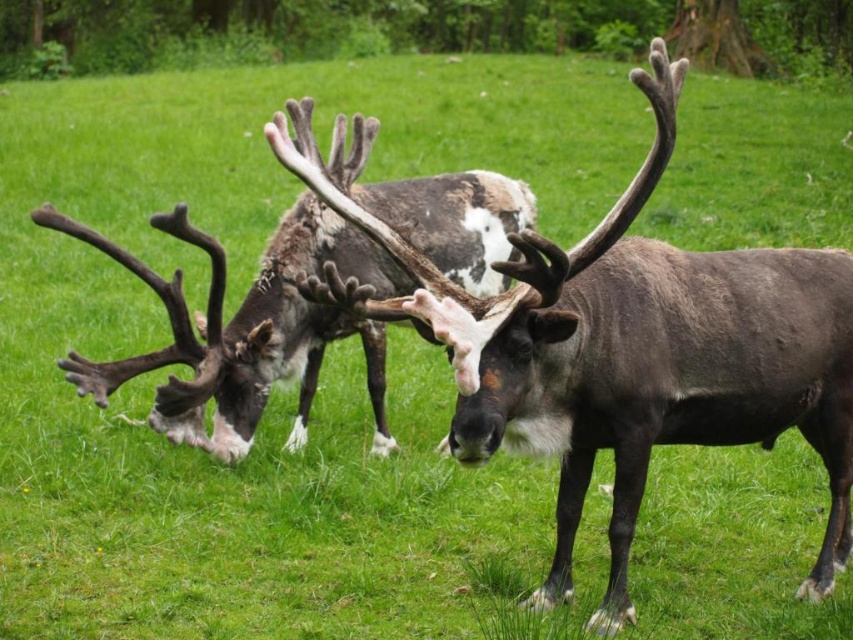
Question: Is dark brown fur antlers at center above speckled fur reindeer at center?

Choices:
 (A) no
 (B) yes

Answer: (A)

Question: Does dark brown fur antlers at center have a lesser width compared to speckled fur reindeer at center?

Choices:
 (A) no
 (B) yes

Answer: (B)

Question: Which of the following is the closest to the observer?

Choices:
 (A) dark brown fur antlers at center
 (B) speckled fur reindeer at center

Answer: (A)

Question: Which point appears closest to the camera in this image?

Choices:
 (A) (466, 285)
 (B) (699, 435)

Answer: (B)

Question: Does dark brown fur antlers at center appear on the left side of speckled fur reindeer at center?

Choices:
 (A) no
 (B) yes

Answer: (A)

Question: Which object appears farthest from the camera in this image?

Choices:
 (A) dark brown fur antlers at center
 (B) speckled fur reindeer at center

Answer: (B)